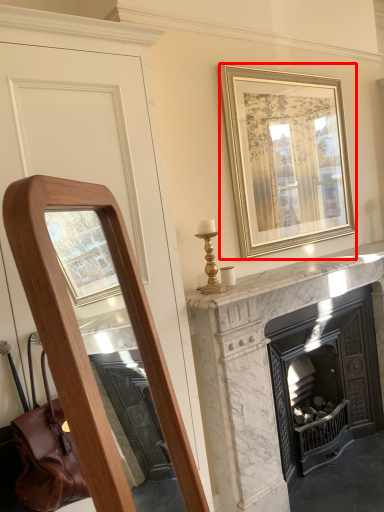
Question: Considering the relative positions of picture frame (annotated by the red box) and fireplace in the image provided, where is picture frame (annotated by the red box) located with respect to the staircase?

Choices:
 (A) left
 (B) right

Answer: (A)